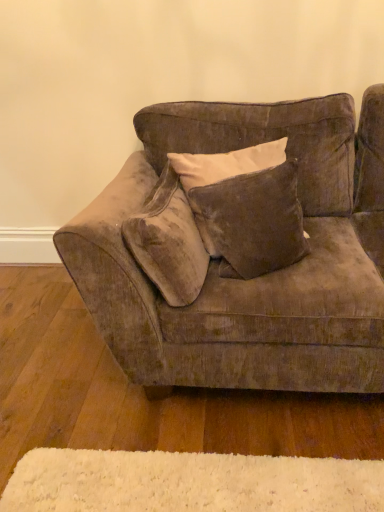
Question: From the image's perspective, is velvet brown pillow at center, the first pillow from the right, on white fluffy mat at lower center?

Choices:
 (A) no
 (B) yes

Answer: (B)

Question: Is velvet brown pillow at center, which appears as the 2th pillow when viewed from the left, placed right next to white fluffy mat at lower center?

Choices:
 (A) yes
 (B) no

Answer: (B)

Question: Is velvet brown pillow at center, which appears as the 2th pillow when viewed from the left, closer to the viewer compared to white fluffy mat at lower center?

Choices:
 (A) yes
 (B) no

Answer: (B)

Question: Is velvet brown pillow at center, which appears as the 2th pillow when viewed from the left, positioned behind white fluffy mat at lower center?

Choices:
 (A) no
 (B) yes

Answer: (B)

Question: From the image's perspective, is velvet brown pillow at center, the first pillow from the right, under white fluffy mat at lower center?

Choices:
 (A) yes
 (B) no

Answer: (B)

Question: Would you say velvet beige pillow at center, the first pillow viewed from the left, is inside or outside velvet brown pillow at center, the first pillow from the right?

Choices:
 (A) outside
 (B) inside

Answer: (A)

Question: From the image's perspective, is velvet beige pillow at center, the 2th pillow from the right, located above or below velvet brown pillow at center, which appears as the 2th pillow when viewed from the left?

Choices:
 (A) below
 (B) above

Answer: (A)

Question: Is velvet beige pillow at center, the 2th pillow from the right, in front of or behind velvet brown pillow at center, which appears as the 2th pillow when viewed from the left, in the image?

Choices:
 (A) front
 (B) behind

Answer: (A)

Question: Does point (152, 201) appear closer or farther from the camera than point (279, 231)?

Choices:
 (A) closer
 (B) farther

Answer: (B)

Question: From the image's perspective, is velvet brown pillow at center, which appears as the 2th pillow when viewed from the left, positioned above or below velvet beige pillow at center, the 2th pillow from the right?

Choices:
 (A) below
 (B) above

Answer: (B)

Question: Which is correct: velvet brown pillow at center, which appears as the 2th pillow when viewed from the left, is inside velvet beige pillow at center, the first pillow viewed from the left, or outside of it?

Choices:
 (A) inside
 (B) outside

Answer: (B)

Question: Considering the positions of velvet brown pillow at center, the first pillow from the right, and velvet beige pillow at center, the 2th pillow from the right, in the image, is velvet brown pillow at center, the first pillow from the right, taller or shorter than velvet beige pillow at center, the 2th pillow from the right,?

Choices:
 (A) tall
 (B) short

Answer: (A)

Question: Considering the positions of velvet brown pillow at center, the first pillow from the right, and velvet beige pillow at center, the 2th pillow from the right, in the image, is velvet brown pillow at center, the first pillow from the right, wider or thinner than velvet beige pillow at center, the 2th pillow from the right,?

Choices:
 (A) thin
 (B) wide

Answer: (B)

Question: Based on their sizes in the image, would you say velvet brown couch at center is bigger or smaller than velvet brown pillow at center, which appears as the 2th pillow when viewed from the left?

Choices:
 (A) small
 (B) big

Answer: (B)

Question: In terms of height, does velvet brown couch at center look taller or shorter compared to velvet brown pillow at center, the first pillow from the right?

Choices:
 (A) short
 (B) tall

Answer: (B)